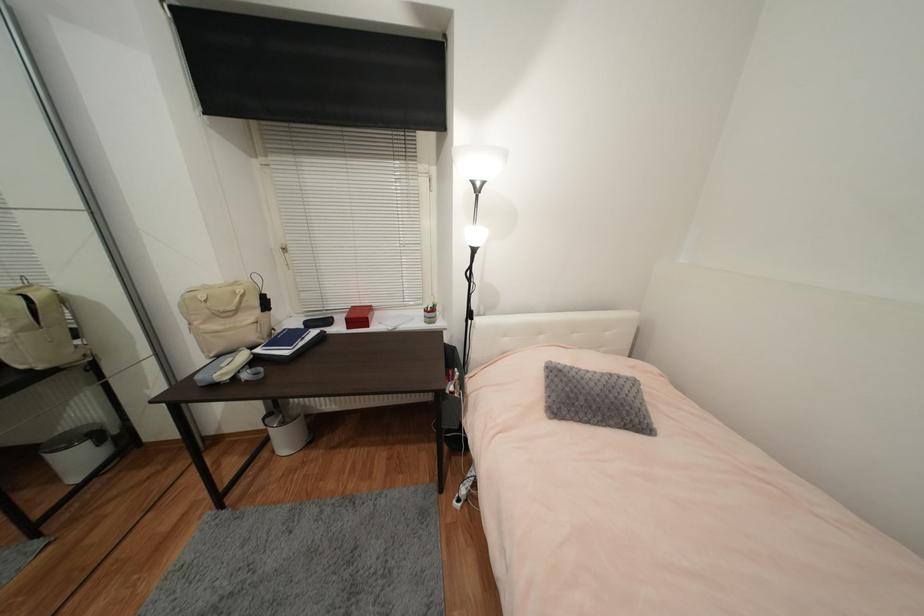
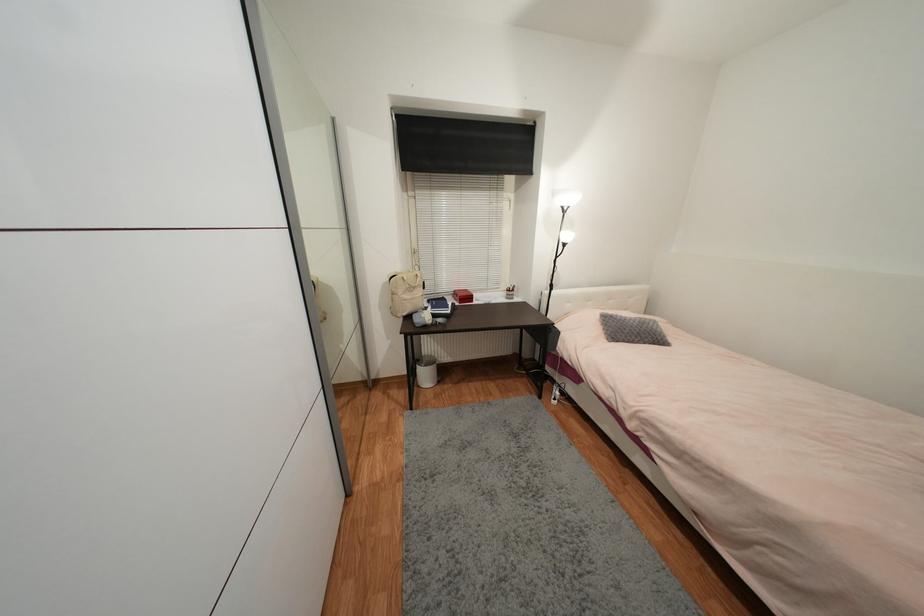
Which direction would the cameraman need to move to produce the second image?

The movement direction of the cameraman is left, backward.